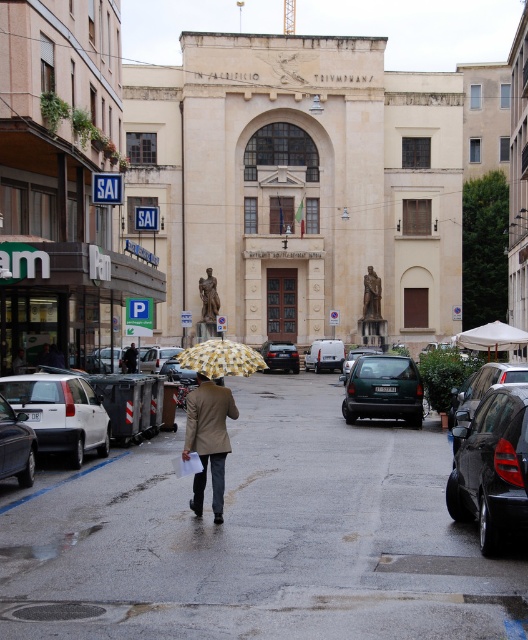
You are a delivery driver who needs to park your truck in the street in front of the building. Your truck is 2 meters wide. Can you park between the shiny black sedan at center and the satin black sedan at center?

The shiny black sedan at center is thinner than the satin black sedan at center, but the total space between them depends on their combined widths. Since the shiny black sedan is thinner, the space between them might be sufficient for your 2m wide truck. However, without knowing the exact distance between the cars, it is uncertain. Please check the actual space available.

You are a delivery driver who needs to park your 5.5 meter long truck in front of the Palazzo Trivulzi. The shiny black sedan at center is blocking the entrance. Can you maneuver around it to park without moving the sedan?

The shiny black sedan at center is 7.61 meters from the camera. Since your truck is 5.5 meters long, you can safely maneuver around it as the distance allows enough space to park without needing to move the sedan.